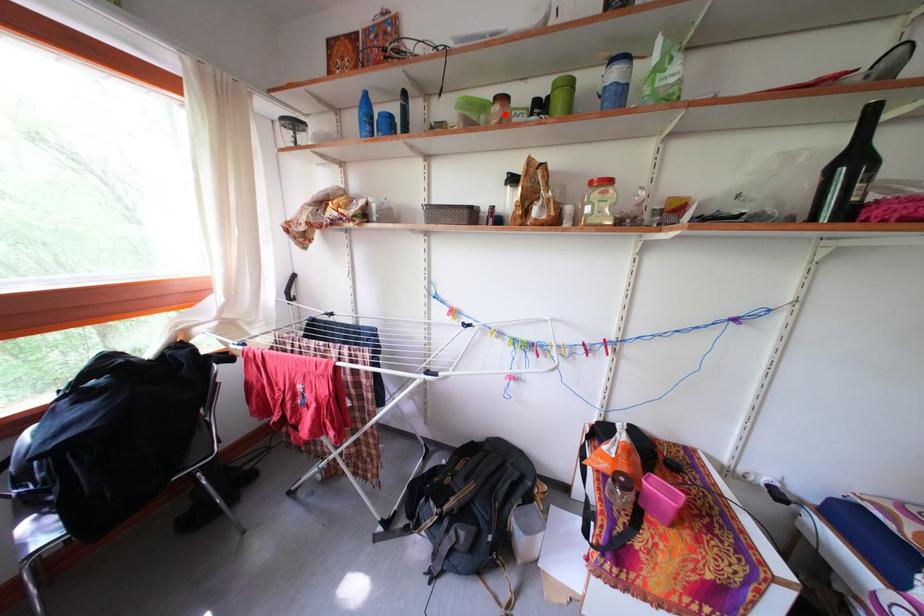
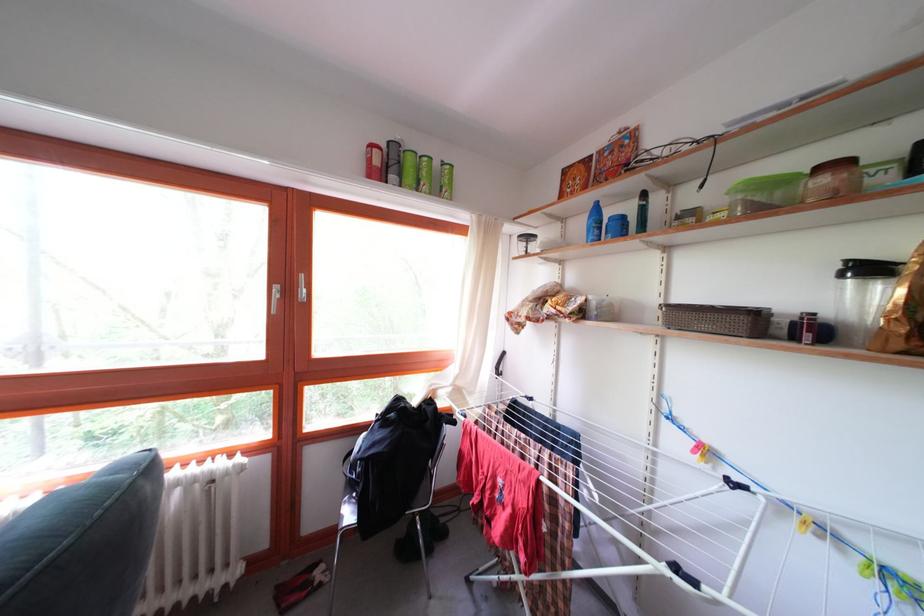
Find the pixel in the second image that matches the highlighted location in the first image.

(832, 187)